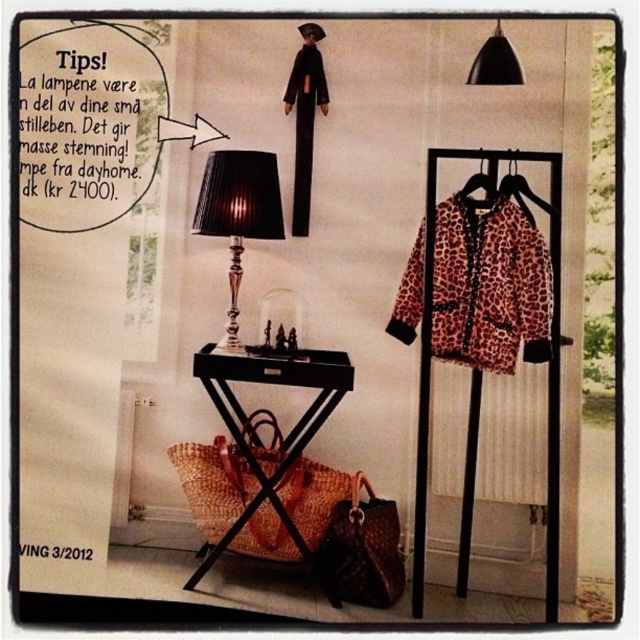
Question: Is woven wood stool at lower center wider than leopard print fabric hanger at upper right?

Choices:
 (A) yes
 (B) no

Answer: (A)

Question: Which point is closer to the camera?

Choices:
 (A) shiny silver lamp at center
 (B) woven wood stool at lower center
 (C) leopard print fabric hanger at upper right
 (D) black matte pendant light at upper right

Answer: (B)

Question: Is leopard print fabric jacket at right positioned in front of black matte pendant light at upper right?

Choices:
 (A) no
 (B) yes

Answer: (A)

Question: Which object appears closest to the camera in this image?

Choices:
 (A) woven wood stool at lower center
 (B) leopard print fabric jacket at right

Answer: (A)

Question: Does woven wood stool at lower center have a greater width compared to leopard print fabric hanger at upper right?

Choices:
 (A) yes
 (B) no

Answer: (A)

Question: Which point is farther to the camera?

Choices:
 (A) (476, 52)
 (B) (486, 196)

Answer: (A)